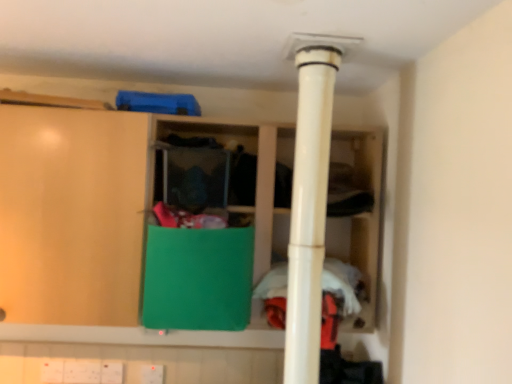
Question: Is white fabric at center wider or thinner than green matte cabinet at center?

Choices:
 (A) wide
 (B) thin

Answer: (B)

Question: In terms of height, does white fabric at center look taller or shorter compared to green matte cabinet at center?

Choices:
 (A) short
 (B) tall

Answer: (A)

Question: Which is farther from the white fabric at center?

Choices:
 (A) green matte cabinet at center
 (B) green fabric at center
 (C) white plastic pipe at center

Answer: (B)

Question: Which object is positioned farthest from the green matte cabinet at center?

Choices:
 (A) white plastic pipe at center
 (B) green fabric at center
 (C) white fabric at center

Answer: (A)